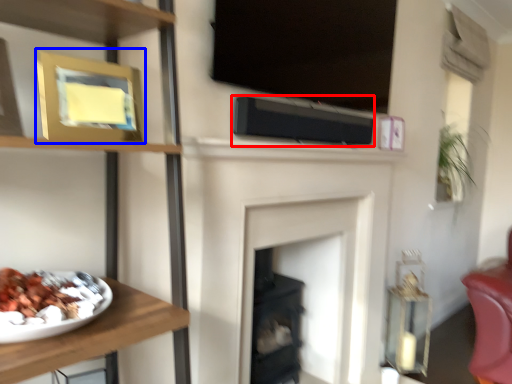
Question: Which object is closer to the camera taking this photo, speaker (highlighted by a red box) or picture frame (highlighted by a blue box)?

Choices:
 (A) speaker
 (B) picture frame

Answer: (B)